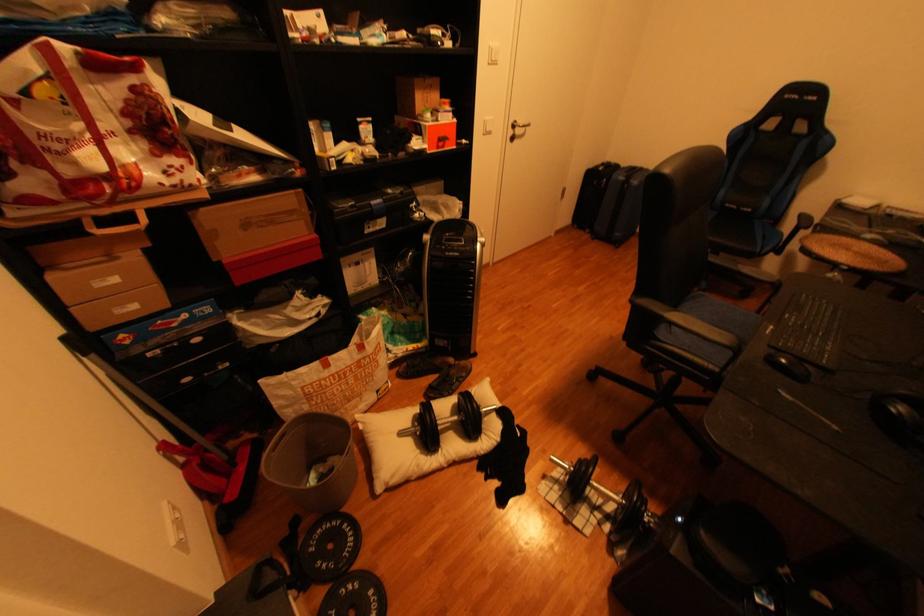
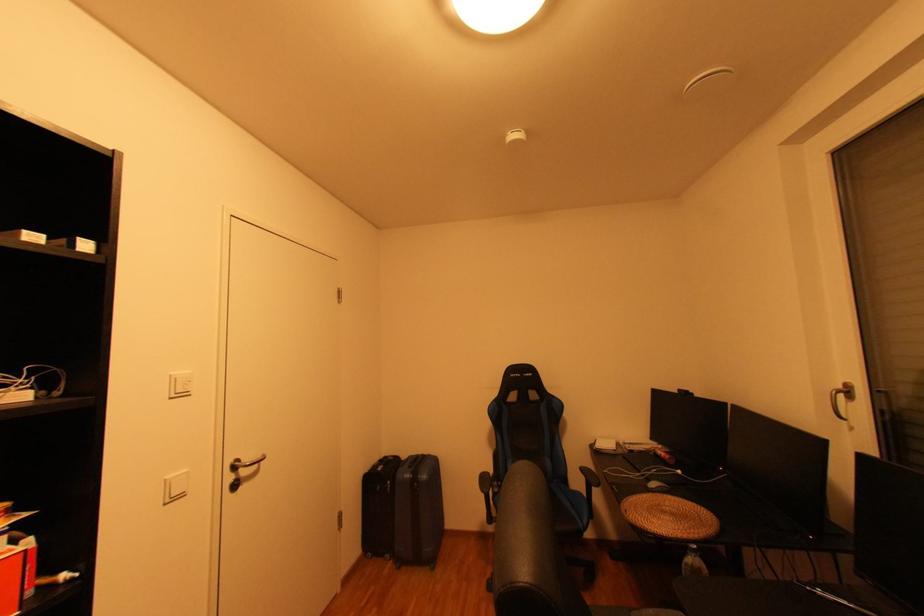
Where in the second image is the point corresponding to point (877, 236) from the first image?

(663, 485)